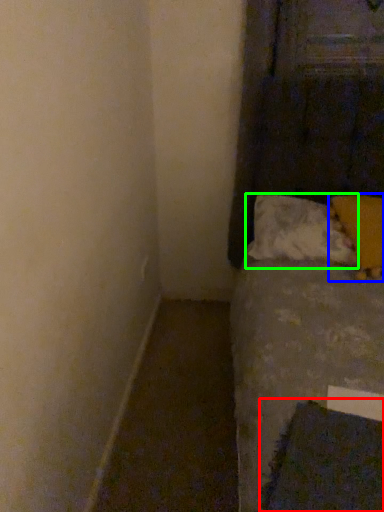
Question: Estimate the real-world distances between objects in this image. Which object is farther from sheet (highlighted by a red box), pillow (highlighted by a blue box) or pillow (highlighted by a green box)?

Choices:
 (A) pillow
 (B) pillow

Answer: (B)